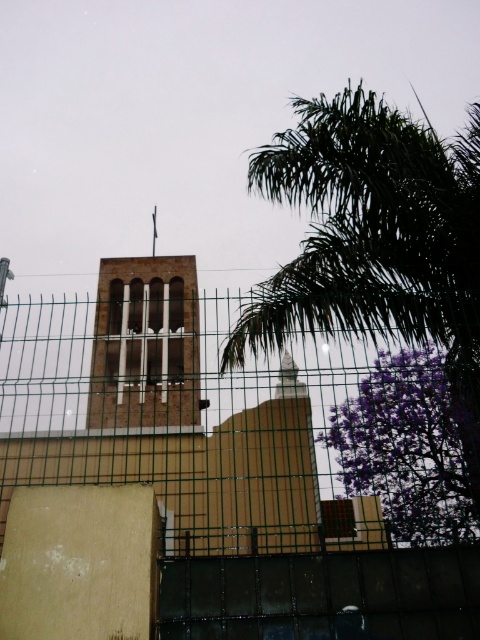
Does green leafy palm tree at upper right have a larger size compared to purple leafy tree at right?

Indeed, green leafy palm tree at upper right has a larger size compared to purple leafy tree at right.

At what (x,y) coordinates should I click in order to perform the action: click on green leafy palm tree at upper right. Please return your answer as a coordinate pair (x, y). This screenshot has width=480, height=640. Looking at the image, I should click on (384, 296).

Is green leafy palm tree at upper right smaller than brown brick bell tower at center?

Incorrect, green leafy palm tree at upper right is not smaller in size than brown brick bell tower at center.

Based on the photo, between green leafy palm tree at upper right and brown brick bell tower at center, which one has less height?

Standing shorter between the two is brown brick bell tower at center.

What do you see at coordinates (384, 296) in the screenshot?
I see `green leafy palm tree at upper right` at bounding box center [384, 296].

Locate an element on the screen. Image resolution: width=480 pixels, height=640 pixels. green leafy palm tree at upper right is located at coordinates (384, 296).

Which is behind, point (335, 518) or point (429, 352)?

The point (429, 352) is more distant.

Consider the image. Which of these two, green wire mesh fence at center or purple leafy tree at right, stands shorter?

With less height is green wire mesh fence at center.

Describe the element at coordinates (187, 442) in the screenshot. This screenshot has width=480, height=640. I see `green wire mesh fence at center` at that location.

Identify the location of green wire mesh fence at center. (187, 442).